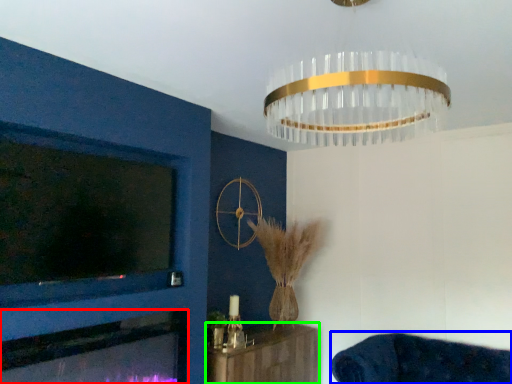
Question: Which object is the farthest from fireplace (highlighted by a red box)? Choose among these: furniture (highlighted by a blue box) or furniture (highlighted by a green box).

Choices:
 (A) furniture
 (B) furniture

Answer: (A)